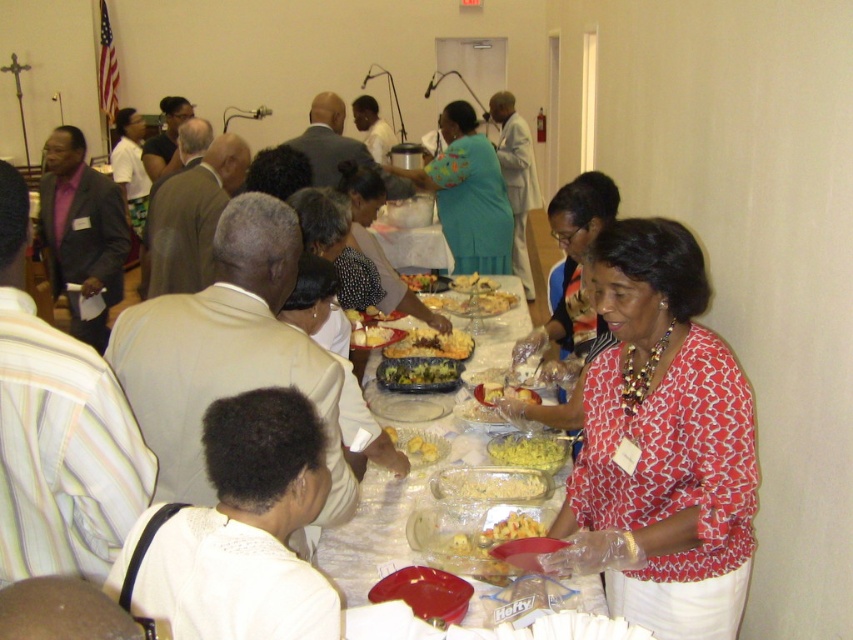
You are standing at the entrance of the hall and see two points marked in the image. Which point is closer to you, point (627,497) or point (370,259)?

Point (627,497) is in front of point (370,259), so it is closer to you.

You are attending the event and want to see both the red printed blouse at center and the polka dot blouse at center. Which one is positioned higher up?

The polka dot blouse at center is positioned higher up because the red printed blouse at center is below it.

You are a guest at this event and want to choose a blouse to wear that is wider. Which one should you pick between the red printed blouse at center and the polka dot blouse at center?

The polka dot blouse at center is wider than the red printed blouse at center, so you should pick the polka dot blouse at center.